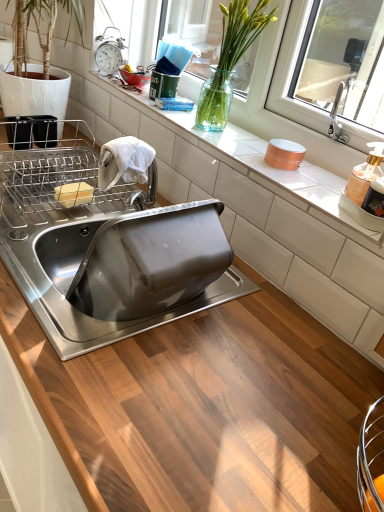
Identify the location of vacant space behind translucent plastic soap dispenser at right. (314, 183).